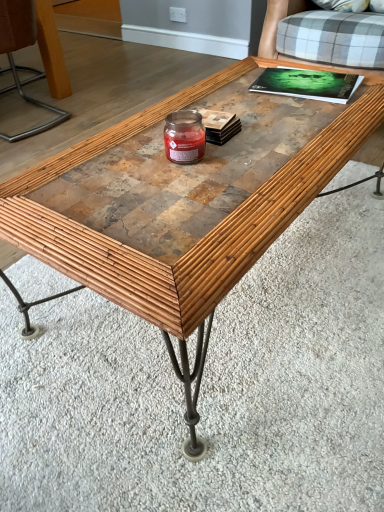
Identify the location of wooden chair leg at upper left. (21, 48).

Describe the element at coordinates (21, 48) in the screenshot. I see `wooden chair leg at upper left` at that location.

At what (x,y) coordinates should I click in order to perform the action: click on wooden chair leg at upper left. Please return your answer as a coordinate pair (x, y). This screenshot has width=384, height=512. Looking at the image, I should click on (21, 48).